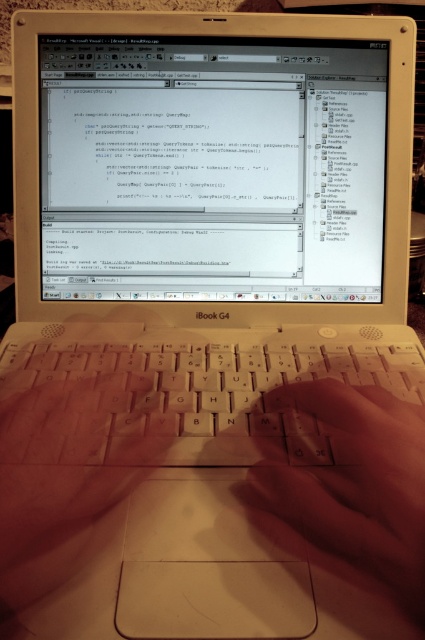
Is matte black screen at center bigger than white plastic keyboard at center?

No.

Which is in front, point (231, 148) or point (70, 362)?

Positioned in front is point (70, 362).

At what (x,y) coordinates should I click in order to perform the action: click on matte black screen at center. Please return your answer as a coordinate pair (x, y). This screenshot has width=425, height=640. Looking at the image, I should click on (212, 168).

From the picture: Is matte black screen at center positioned behind smooth skin hand at center?

Yes, matte black screen at center is further from the viewer.

At what (x,y) coordinates should I click in order to perform the action: click on matte black screen at center. Please return your answer as a coordinate pair (x, y). The width and height of the screenshot is (425, 640). Looking at the image, I should click on (212, 168).

Find the location of a particular element. The image size is (425, 640). matte black screen at center is located at coordinates (212, 168).

Between point (96, 348) and point (269, 531), which one is positioned in front?

Point (269, 531) is more forward.

Is white plastic keyboard at center thinner than smooth skin hand at center?

No.

Is point (408, 358) behind point (251, 481)?

Yes, it is behind point (251, 481).

Locate an element on the screen. white plastic keyboard at center is located at coordinates (198, 388).